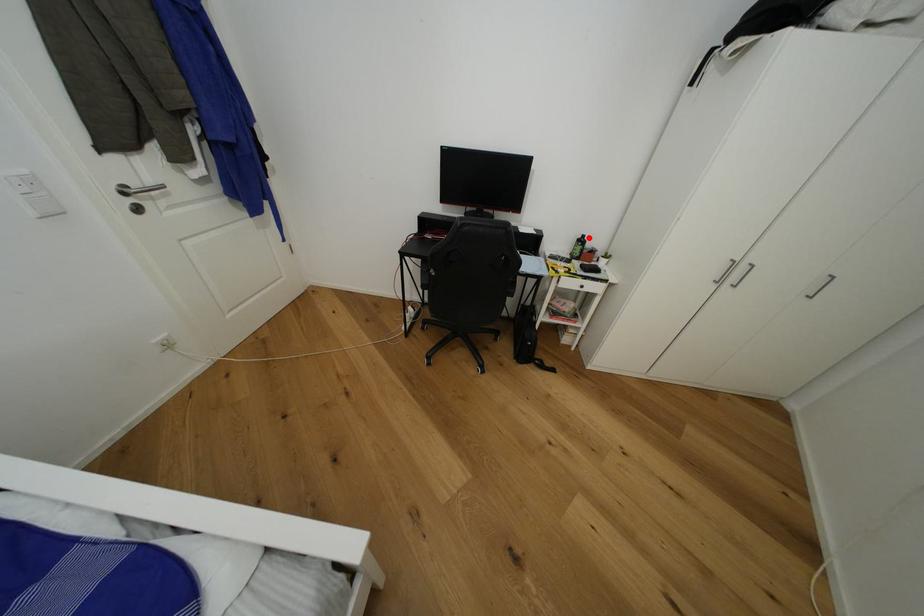
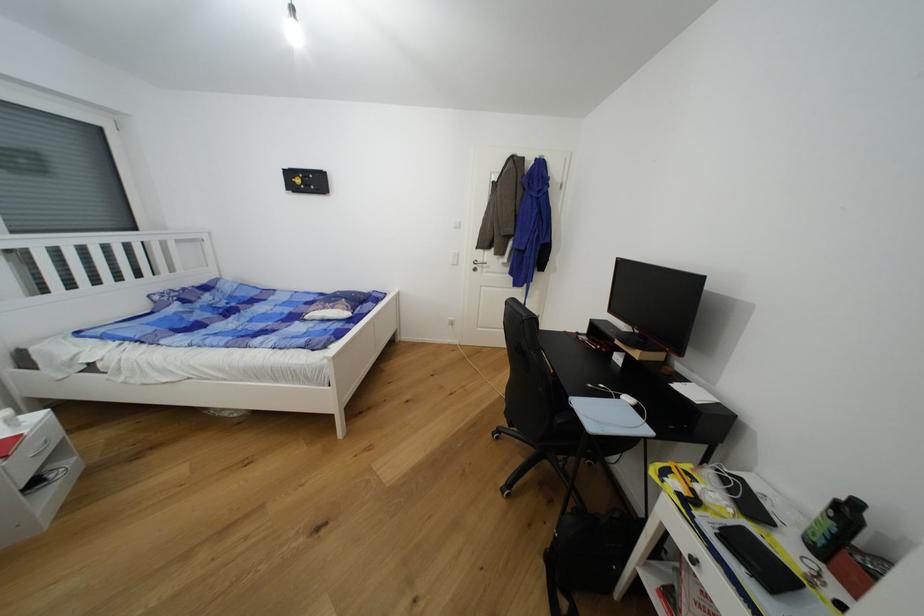
Find the pixel in the second image that matches the highlighted location in the first image.

(862, 506)